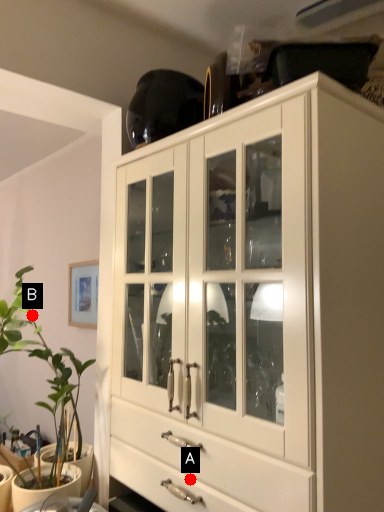
Question: Two points are circled on the image, labeled by A and B beside each circle. Which point appears farthest from the camera in this image?

Choices:
 (A) A is further
 (B) B is further

Answer: (B)